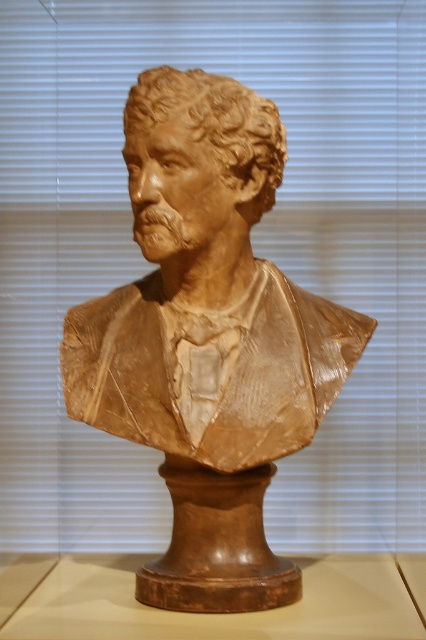
You are an art student observing the sculpture display. You notice two busts at the center. Which one is closer to you, the matte brown bust at center or the brown clay bust at center?

The matte brown bust at center is closer to you because it is in front of the brown clay bust at center.

You are an art curator arranging an exhibition. You have two bust sculptures, the matte brown bust at center and the brown clay bust at center. The gallery requires that sculptures must be at least 5 inches apart for safety. Can you place them as per the current spacing?

The matte brown bust at center and the brown clay bust at center are currently 4.62 inches apart, which is less than the required 5 inches. Therefore, they need to be moved further apart to meet the safety requirement.

You are an art curator deciding between two bust sculptures for an exhibition. The first is the matte brown bust at center, and the second is the brown clay bust at center. Based on their dimensions, which one would have a larger width and thus require more space on the display shelf?

The matte brown bust at center has a greater width than the brown clay bust at center, so it requires more space on the display shelf.